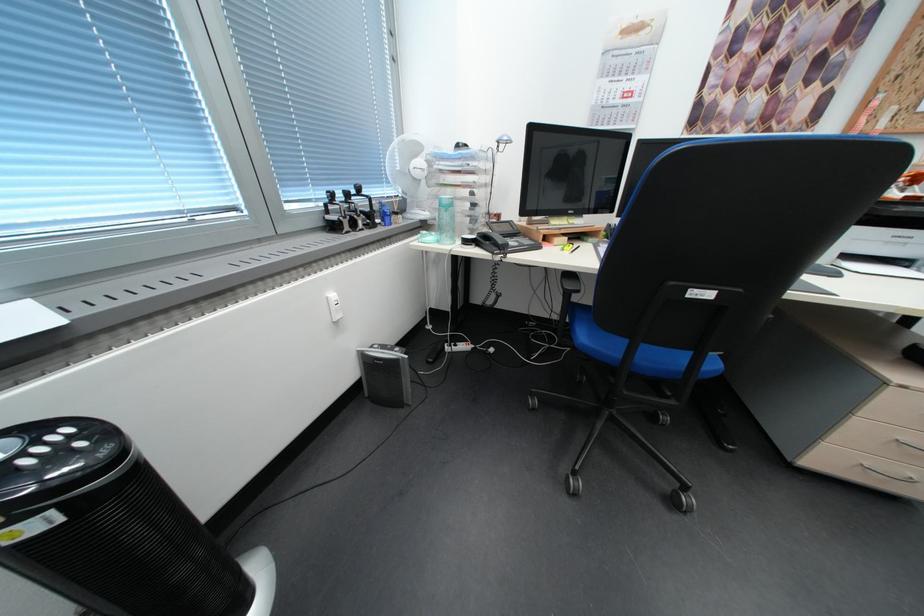
What do you see at coordinates (569, 284) in the screenshot? I see `a chair armrest` at bounding box center [569, 284].